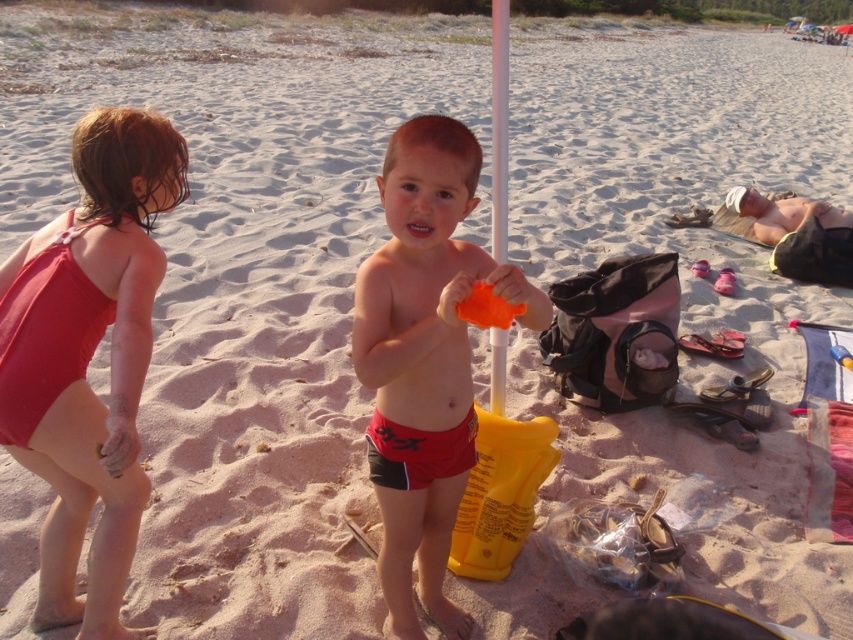
Is matte red shorts at center thinner than beige fabric towel at right?

Indeed, matte red shorts at center has a lesser width compared to beige fabric towel at right.

What do you see at coordinates (424, 358) in the screenshot?
I see `matte red shorts at center` at bounding box center [424, 358].

Where is `matte red shorts at center`? This screenshot has height=640, width=853. matte red shorts at center is located at coordinates 424,358.

At what (x,y) coordinates should I click in order to perform the action: click on matte red shorts at center. Please return your answer as a coordinate pair (x, y). Looking at the image, I should click on (424, 358).

Which is behind, point (25, 436) or point (494, 336)?

Point (494, 336)

You are a GUI agent. You are given a task and a screenshot of the screen. Output one action in this format:
    pyautogui.click(x=<x>, y=<y>)
    Task: Click on the matte red swimsuit at left
    
    Given the screenshot: What is the action you would take?
    pyautogui.click(x=90, y=356)

Is matte red swimsuit at left behind matte red shorts at center?

That is True.

Can you confirm if matte red swimsuit at left is positioned above matte red shorts at center?

Yes, matte red swimsuit at left is above matte red shorts at center.

Between point (38, 426) and point (395, 465), which one is positioned in front?

Point (38, 426) is in front.

In order to click on matte red swimsuit at left in this screenshot , I will do `click(90, 356)`.